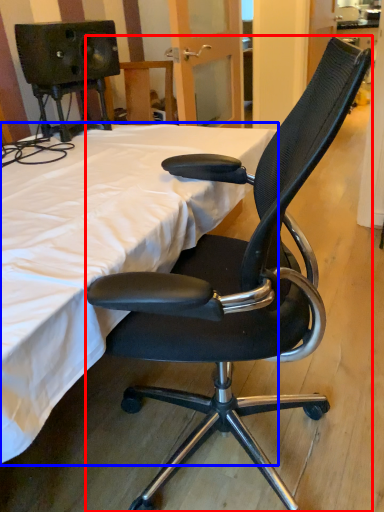
Question: Among these objects, which one is farthest to the camera, chair (highlighted by a red box) or bed (highlighted by a blue box)?

Choices:
 (A) chair
 (B) bed

Answer: (B)